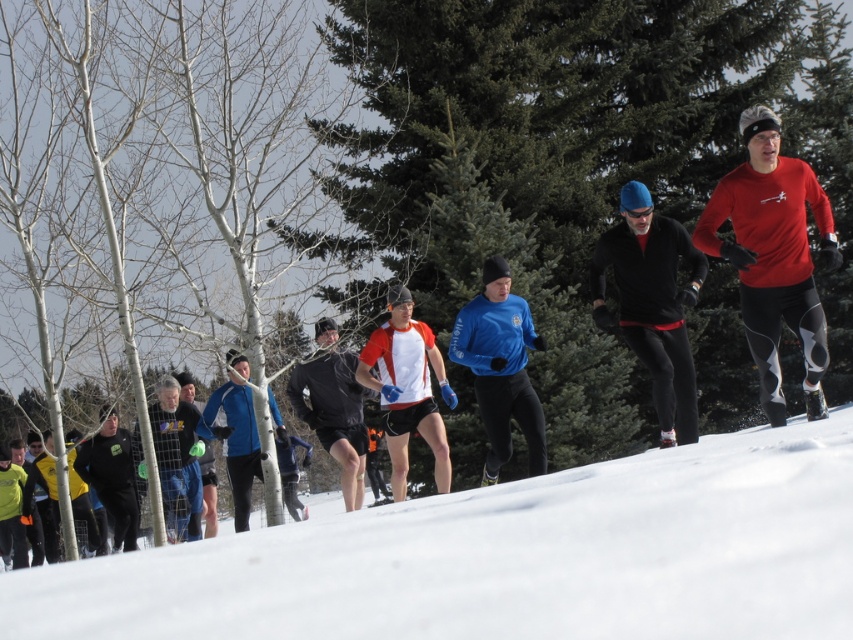
You are a photographer standing at the edge of the winter race course. You want to capture a photo where the blue fleece jacket at center is in focus while keeping the white snow at lower center slightly out of focus. Is this possible with your current camera settings?

Yes, since the white snow at lower center is closer to the viewer than the blue fleece jacket at center, adjusting the focus to the blue fleece jacket at center while keeping the white snow at lower center out of focus is achievable by using a shallow depth of field.

You are a photographer trying to capture the winter running event. You want to focus on both the point at [828,570] and the point at [239,401]. Which point should you adjust your camera focus to first to ensure the closest subject is sharp?

Point [828,570] is closer to the camera than point [239,401], so you should focus on point [828,570] first to ensure the closest subject is sharp.

You are a photographer at the winter running event. You want to capture a photo where the blue fabric jacket at center is clearly visible above the white snow at lower center. Based on their heights, is this possible?

The white snow at lower center is not as tall as the blue fabric jacket at center, so yes, the blue fabric jacket at center will be visible above the white snow at lower center in the photo.